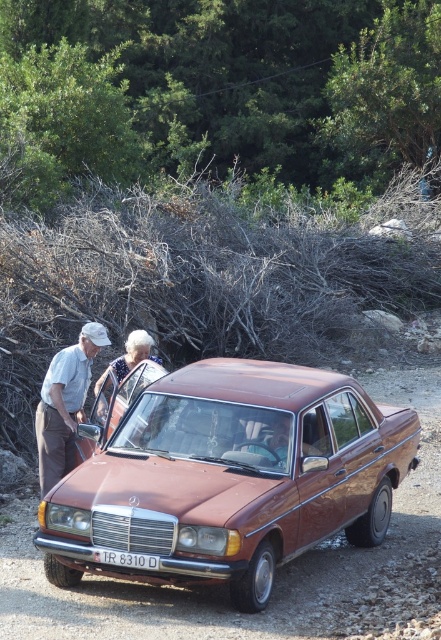
You are a photographer trying to capture a closeup of the white plastic license plate at center while also ensuring the white textured dress at center is visible in the frame. Given their sizes, which object should you focus on to ensure both are in the shot without zooming in too much?

The white textured dress at center is wider than the white plastic license plate at center, so focusing on the dress will allow both to be captured in the frame without excessive zooming.

In the scene shown: You are standing at the point labeled point (97, 513). If you look behind you, will you see the point labeled point (141, 349)?

Yes, because point (97, 513) is in front of point (141, 349), so looking behind from point (97, 513) would allow you to see point (141, 349).